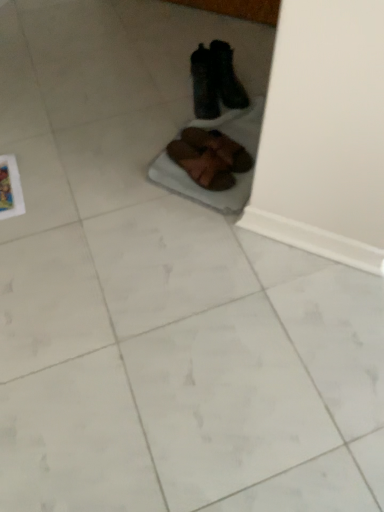
Locate an element on the screen. blank space to the left of black leather boots at upper center, which ranks as the fourth footwear in bottom-to-top order is located at coordinates (172, 93).